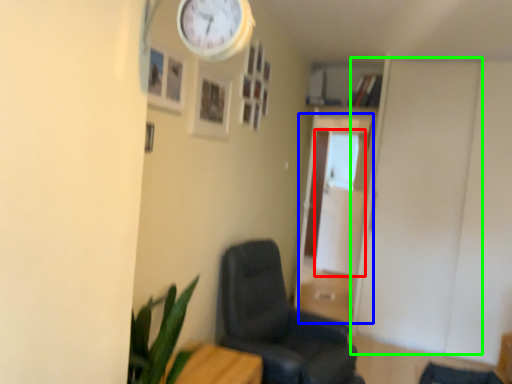
Question: Estimate the real-world distances between objects in this image. Which object is farther from glass door (highlighted by a red box), glass door (highlighted by a blue box) or door (highlighted by a green box)?

Choices:
 (A) glass door
 (B) door

Answer: (B)